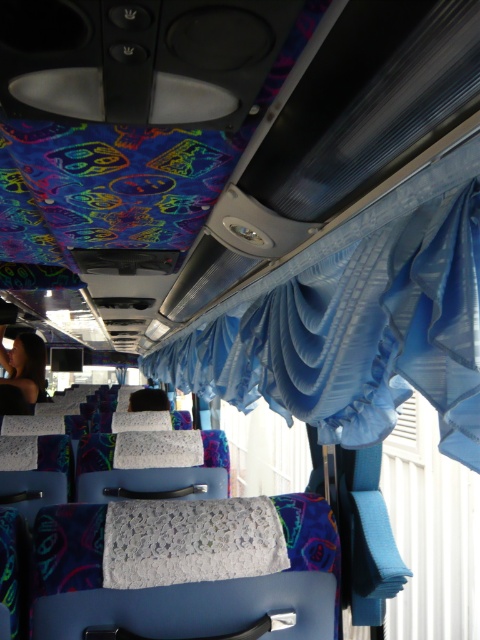
Question: Which point appears closest to the camera in this image?

Choices:
 (A) (250, 316)
 (B) (191, 518)
 (C) (28, 364)

Answer: (B)

Question: Which point is farther to the camera?

Choices:
 (A) (465, 330)
 (B) (107, 509)

Answer: (B)

Question: Can you confirm if blue satin curtain at upper center is positioned to the left of white lace cloth at center?

Choices:
 (A) yes
 (B) no

Answer: (B)

Question: Does blue satin curtain at upper center appear over white lace cloth at center?

Choices:
 (A) no
 (B) yes

Answer: (B)

Question: Is blue satin curtain at upper center smaller than white lace cloth at center?

Choices:
 (A) yes
 (B) no

Answer: (B)

Question: Which object appears farthest from the camera in this image?

Choices:
 (A) blue satin curtain at upper center
 (B) dark hair at left

Answer: (B)